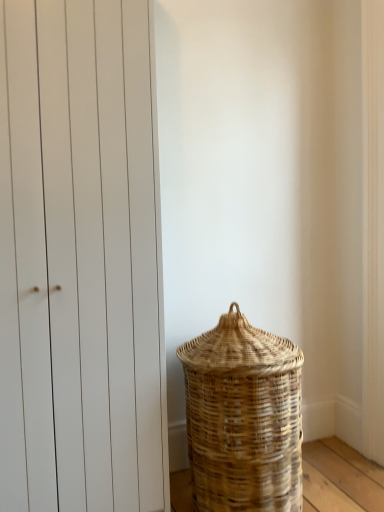
Question: From their relative heights in the image, would you say white matte door at left is taller or shorter than natural woven basket at lower right?

Choices:
 (A) short
 (B) tall

Answer: (B)

Question: Looking at their shapes, would you say white matte door at left is wider or thinner than natural woven basket at lower right?

Choices:
 (A) thin
 (B) wide

Answer: (A)

Question: Considering their positions, is white matte door at left located in front of or behind natural woven basket at lower right?

Choices:
 (A) behind
 (B) front

Answer: (B)

Question: Is point (203, 401) positioned closer to the camera than point (112, 495)?

Choices:
 (A) farther
 (B) closer

Answer: (A)

Question: Would you say natural woven basket at lower right is to the left or to the right of white matte door at left in the picture?

Choices:
 (A) left
 (B) right

Answer: (B)

Question: From the image's perspective, is natural woven basket at lower right located above or below white matte door at left?

Choices:
 (A) below
 (B) above

Answer: (A)

Question: In terms of height, does natural woven basket at lower right look taller or shorter compared to white matte door at left?

Choices:
 (A) tall
 (B) short

Answer: (B)